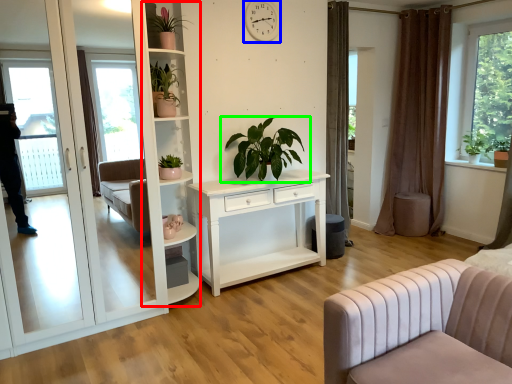
Question: Which is nearer to the bookshelf (highlighted by a red box)? clock (highlighted by a blue box) or houseplant (highlighted by a green box).

Choices:
 (A) clock
 (B) houseplant

Answer: (B)